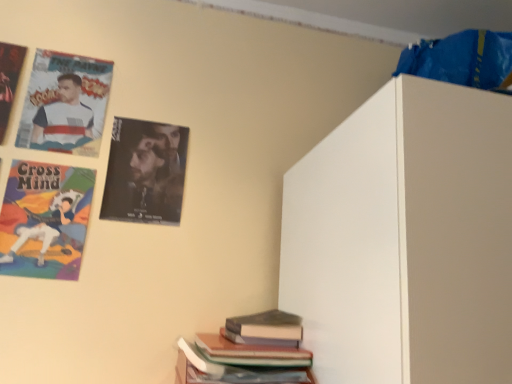
Question: In terms of height, does hardcover book at lower right, the 1th book in the top-to-bottom sequence, look taller or shorter compared to matte paper poster at upper left, which is counted as the second poster, starting from the right?

Choices:
 (A) short
 (B) tall

Answer: (A)

Question: Is hardcover book at lower right, the 1th book in the top-to-bottom sequence, wider or thinner than matte paper poster at upper left, which is counted as the second poster, starting from the right?

Choices:
 (A) thin
 (B) wide

Answer: (B)

Question: Which object is positioned farthest from the hardcover book at lower center, the 2th book viewed from the top?

Choices:
 (A) cartoon character poster at upper left
 (B) hardcover book at lower right, placed as the 2th book when sorted from bottom to top
 (C) matte paper poster at upper left, the first poster from the left
 (D) black glossy poster at upper left, which is the third poster from left to right
 (E) matte paper poster at upper left, the second poster when ordered from left to right

Answer: (C)

Question: Which of these objects is positioned closest to the hardcover book at lower center, the 2th book viewed from the top?

Choices:
 (A) hardcover book at lower right, the 1th book in the top-to-bottom sequence
 (B) cartoon character poster at upper left
 (C) matte paper poster at upper left, the second poster when ordered from left to right
 (D) black glossy poster at upper left, positioned as the first poster in right-to-left order
 (E) matte paper poster at upper left, the first poster from the left

Answer: (A)